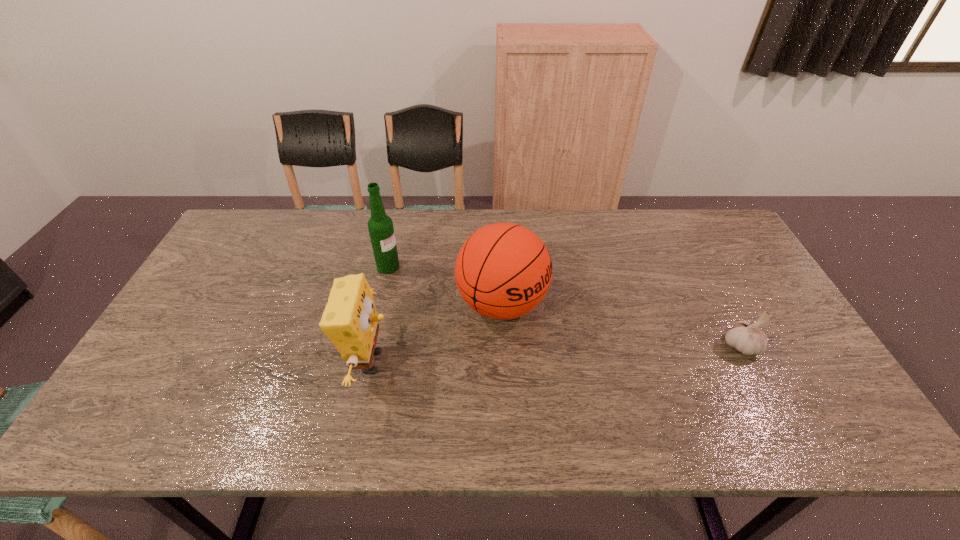
This screenshot has height=540, width=960. What are the coordinates of `vacant spot on the desktop that is between the sponge and the shortest object and is positioned on the side with logo of the basketball` in the screenshot? It's located at (595, 352).

The image size is (960, 540). What are the coordinates of `free spot on the desktop that is between the sponge and the rightmost object and is positioned on the label of the beer bottle` in the screenshot? It's located at (589, 353).